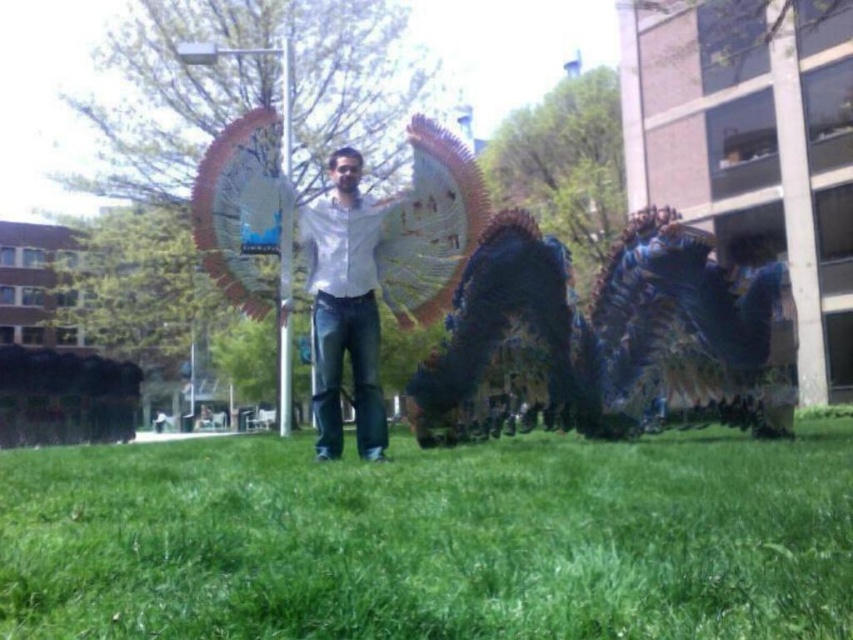
You are standing at the point marked by the coordinates point [432,538] in the image. What is directly beneath your feet?

The point [432,538] indicates green grass at lower center, so the green grass at lower center is directly beneath your feet.

You are a photographer trying to capture a wide shot of the scene. The white matte shirt at center and metallic pole at center are both in the frame. Which object is wider in the photo?

The white matte shirt at center is wider than the metallic pole at center in the photo.